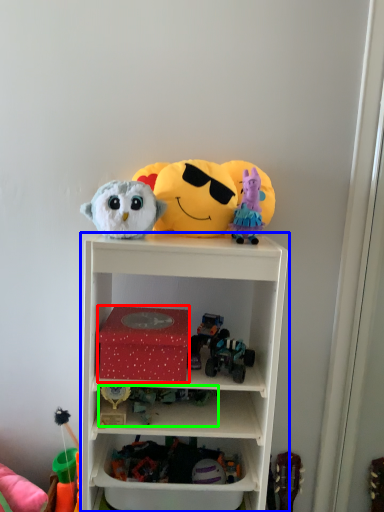
Question: Considering the real-world distances, which object is farthest from box (highlighted by a red box)? shelf (highlighted by a blue box) or toy (highlighted by a green box)?

Choices:
 (A) shelf
 (B) toy

Answer: (A)